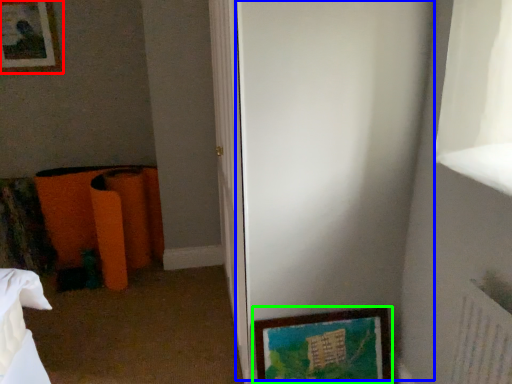
Question: Estimate the real-world distances between objects in this image. Which object is farther from picture frame (highlighted by a red box), screen door (highlighted by a blue box) or picture frame (highlighted by a green box)?

Choices:
 (A) screen door
 (B) picture frame

Answer: (B)